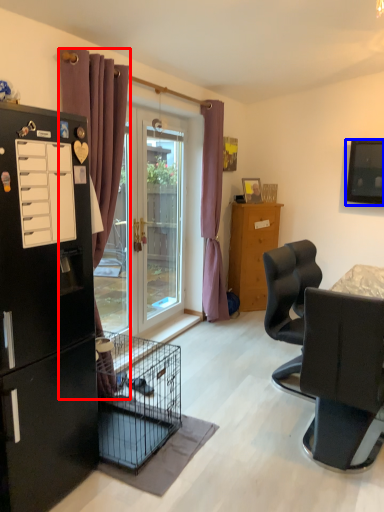
Question: Among these objects, which one is farthest to the camera, curtain (highlighted by a red box) or television (highlighted by a blue box)?

Choices:
 (A) curtain
 (B) television

Answer: (B)